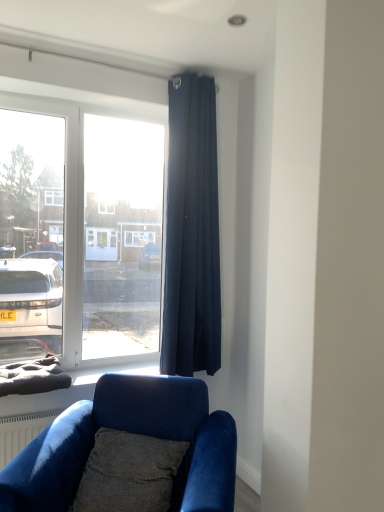
This screenshot has width=384, height=512. In order to click on free space above dark blue fabric curtain at upper right (from a real-world perspective) in this screenshot , I will do `click(189, 64)`.